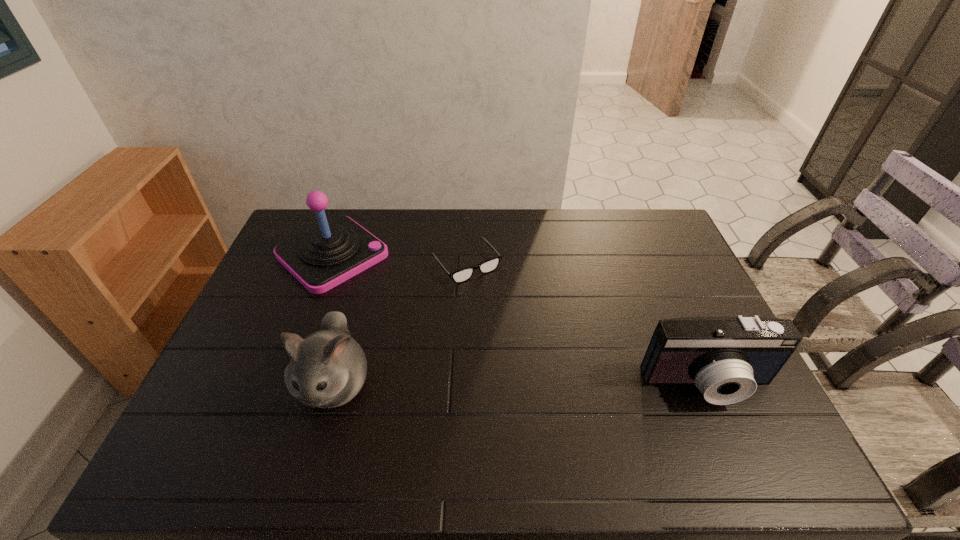
At what (x,y) coordinates should I click in order to perform the action: click on hamster. Please return your answer as a coordinate pair (x, y). The image size is (960, 540). Looking at the image, I should click on (328, 368).

This screenshot has height=540, width=960. I want to click on camcorder, so click(726, 358).

The height and width of the screenshot is (540, 960). What are the coordinates of `the shortest object` in the screenshot? It's located at (462, 275).

Locate an element on the screen. This screenshot has width=960, height=540. the second object from right to left is located at coordinates (462, 275).

This screenshot has height=540, width=960. I want to click on joystick, so click(321, 258).

I want to click on free space located 0.390m on the front-facing side of the second object from right to left, so click(x=555, y=373).

Find the location of a particular element. The height and width of the screenshot is (540, 960). blank space located on the front-facing side of the second object from right to left is located at coordinates (538, 352).

I want to click on vacant position located 0.270m on the front-facing side of the second object from right to left, so click(529, 342).

Where is `free space located 0.180m forward from the base of the joystick`? This screenshot has width=960, height=540. free space located 0.180m forward from the base of the joystick is located at coordinates (398, 311).

Find the location of a particular element. Image resolution: width=960 pixels, height=540 pixels. vacant space situated 0.290m forward from the base of the joystick is located at coordinates (421, 332).